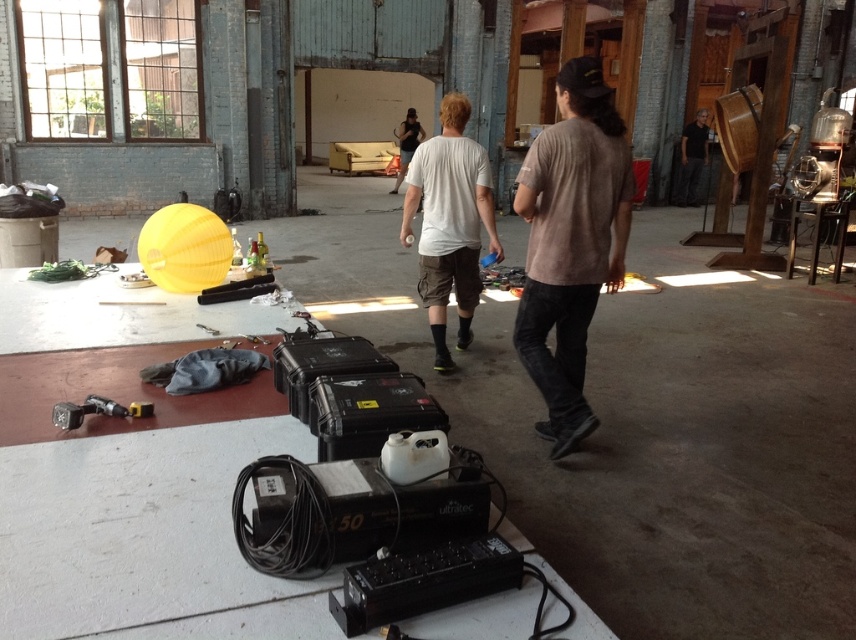
Between point (699, 129) and point (146, 410), which one is positioned in front?

Positioned in front is point (146, 410).

Who is lower down, dark gray jeans at right or metallic silver drill at lower left?

Positioned lower is metallic silver drill at lower left.

At what (x,y) coordinates should I click in order to perform the action: click on dark gray jeans at right. Please return your answer as a coordinate pair (x, y). The width and height of the screenshot is (856, 640). Looking at the image, I should click on (693, 157).

Is white cotton t-shirt at center smaller than dark gray jeans at right?

Actually, white cotton t-shirt at center might be larger than dark gray jeans at right.

Is white cotton t-shirt at center to the right of dark gray jeans at right from the viewer's perspective?

Incorrect, white cotton t-shirt at center is not on the right side of dark gray jeans at right.

Between point (462, 170) and point (684, 180), which one is positioned in front?

Point (462, 170)

Locate an element on the screen. white cotton t-shirt at center is located at coordinates (449, 221).

Who is more forward, (574, 196) or (403, 157)?

Point (574, 196) is more forward.

This screenshot has height=640, width=856. What do you see at coordinates (571, 243) in the screenshot? I see `brown cotton t-shirt at center` at bounding box center [571, 243].

You are a GUI agent. You are given a task and a screenshot of the screen. Output one action in this format:
    pyautogui.click(x=<x>, y=<y>)
    Task: Click on the brown cotton t-shirt at center
    The width and height of the screenshot is (856, 640).
    Given the screenshot: What is the action you would take?
    pyautogui.click(x=571, y=243)